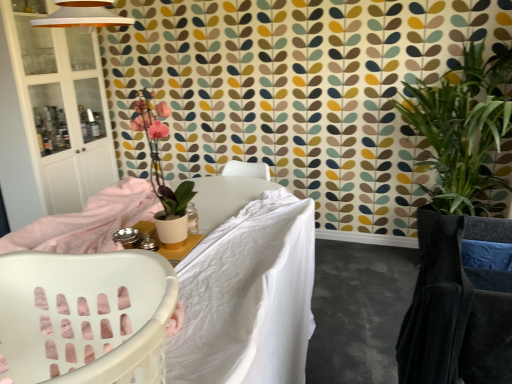
Question: Can you confirm if white fabric bed at center is shorter than white glass cabinet at left?

Choices:
 (A) yes
 (B) no

Answer: (A)

Question: Is white fabric bed at center aimed at white glass cabinet at left?

Choices:
 (A) no
 (B) yes

Answer: (A)

Question: Is white fabric bed at center far away from white glass cabinet at left?

Choices:
 (A) no
 (B) yes

Answer: (B)

Question: Could white glass cabinet at left be considered to be inside white fabric bed at center?

Choices:
 (A) no
 (B) yes

Answer: (A)

Question: Is the position of white fabric bed at center less distant than that of white glass cabinet at left?

Choices:
 (A) yes
 (B) no

Answer: (A)

Question: Is point (470, 193) positioned closer to the camera than point (61, 319)?

Choices:
 (A) farther
 (B) closer

Answer: (A)

Question: From the image's perspective, is green leafy plant at right, placed as the 1th houseplant when sorted from back to front, above or below white plastic laundry basket at left?

Choices:
 (A) below
 (B) above

Answer: (B)

Question: From a real-world perspective, is green leafy plant at right, arranged as the 2th houseplant when viewed from the left, above or below white plastic laundry basket at left?

Choices:
 (A) below
 (B) above

Answer: (A)

Question: Looking at the image, does green leafy plant at right, which appears as the first houseplant when viewed from the right, seem bigger or smaller compared to white plastic laundry basket at left?

Choices:
 (A) big
 (B) small

Answer: (A)

Question: From a real-world perspective, is white soft fabric at center physically located above or below matte white pot at upper left, which is the second houseplant in right-to-left order?

Choices:
 (A) below
 (B) above

Answer: (A)

Question: Looking at their shapes, would you say white soft fabric at center is wider or thinner than matte white pot at upper left, marked as the 1th houseplant in a left-to-right arrangement?

Choices:
 (A) thin
 (B) wide

Answer: (B)

Question: Considering the relative positions of white soft fabric at center and matte white pot at upper left, arranged as the second houseplant when viewed from the back, in the image provided, is white soft fabric at center to the left or to the right of matte white pot at upper left, arranged as the second houseplant when viewed from the back,?

Choices:
 (A) left
 (B) right

Answer: (B)

Question: Is white soft fabric at center taller or shorter than matte white pot at upper left, which is the second houseplant in right-to-left order?

Choices:
 (A) short
 (B) tall

Answer: (B)

Question: Considering the positions of matte white table at center and matte white pot at upper left, arranged as the second houseplant when viewed from the back, in the image, is matte white table at center wider or thinner than matte white pot at upper left, arranged as the second houseplant when viewed from the back,?

Choices:
 (A) thin
 (B) wide

Answer: (B)

Question: Is point (161, 254) closer or farther from the camera than point (173, 236)?

Choices:
 (A) closer
 (B) farther

Answer: (B)